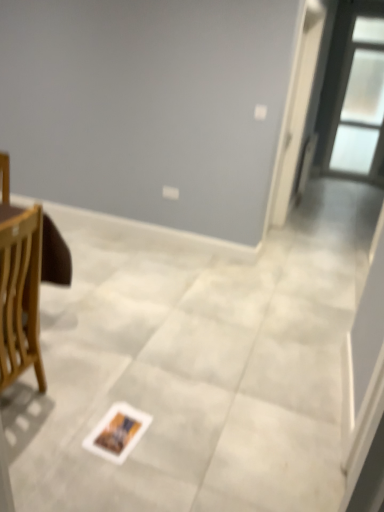
At what (x,y) coordinates should I click in order to perform the action: click on vacant area on the back side of white paper postcard at center. Please return your answer as a coordinate pair (x, y). This screenshot has height=512, width=384. Looking at the image, I should click on (135, 385).